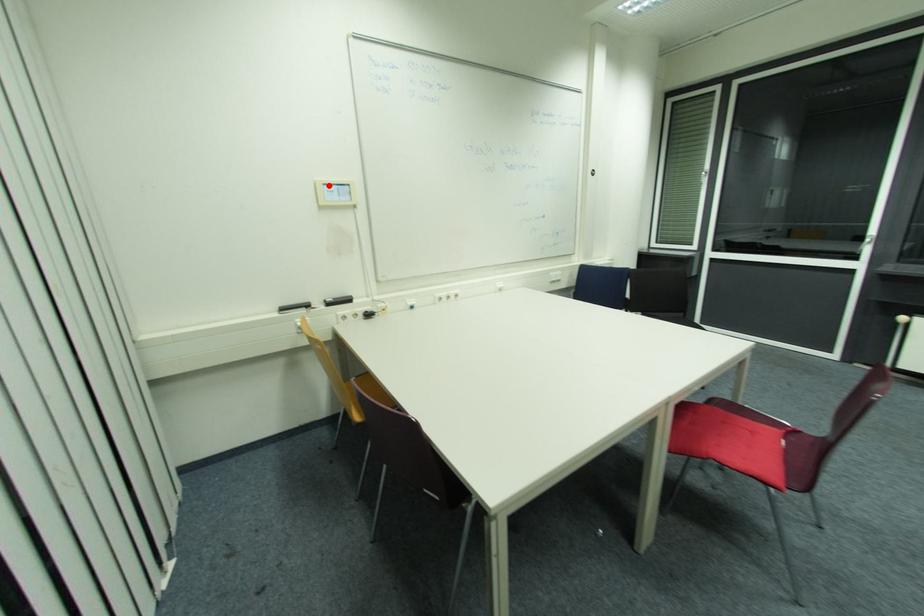
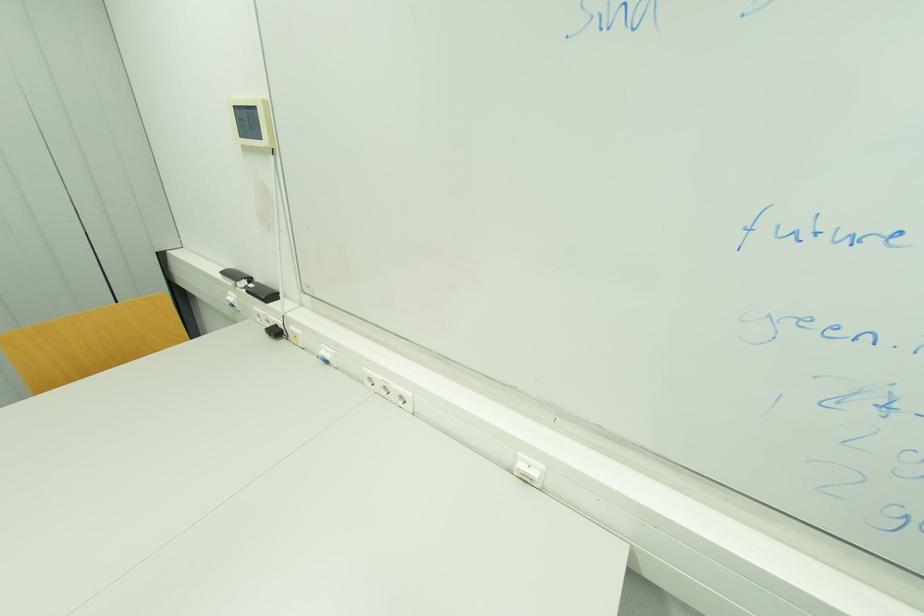
Question: I am providing you with two images of the same scene from different viewpoints. A red point is marked on the first image. At the location where the point appears in image 1, is it still visible in image 2?

Choices:
 (A) Yes
 (B) No

Answer: (A)